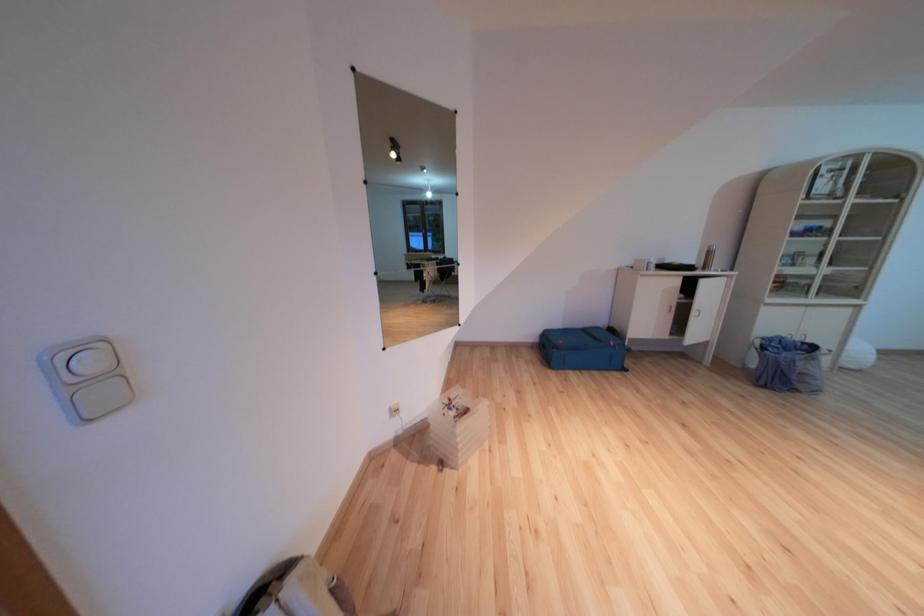
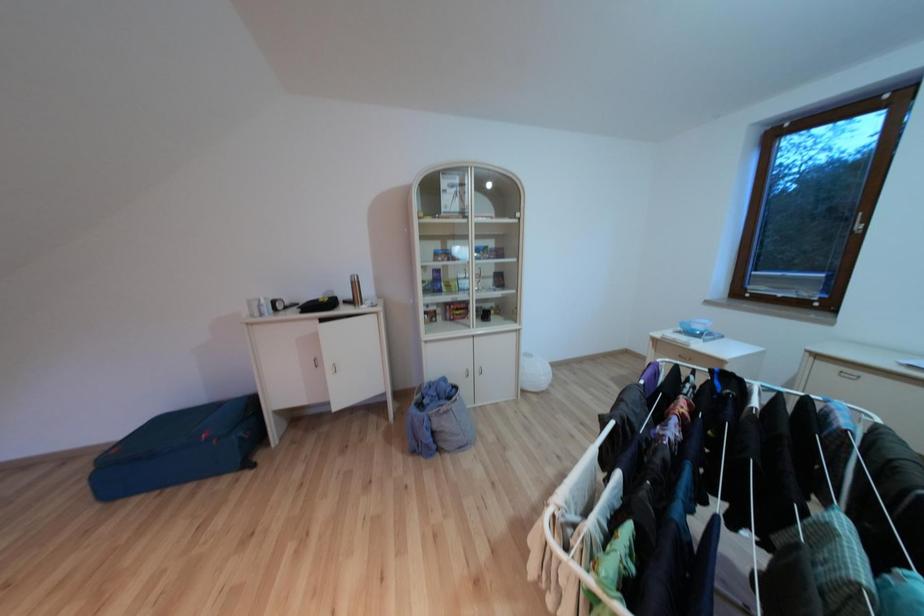
Question: What movement of the cameraman would produce the second image?

Choices:
 (A) Left
 (B) Right
 (C) Forward
 (D) Backward

Answer: (B)